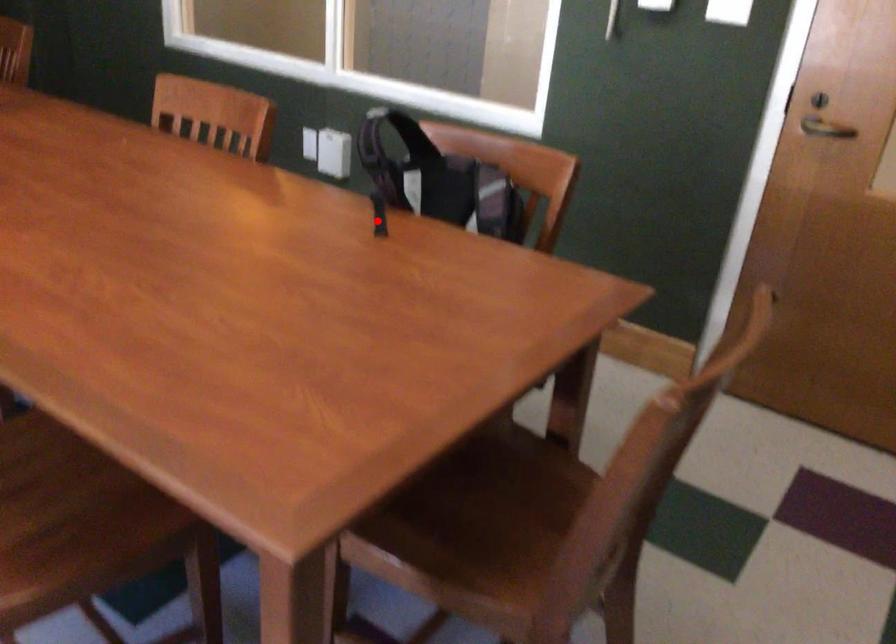
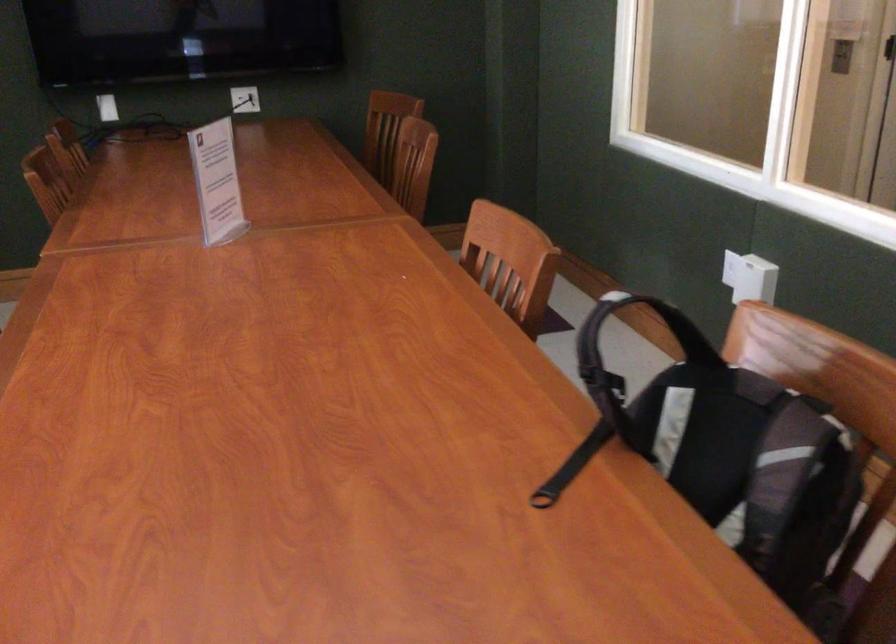
Question: I am providing you with two images of the same scene from different viewpoints. Image1 has a red point marked. In image2, the corresponding 3D location appears at what relative position? Reply with the corresponding letter.

Choices:
 (A) Closer
 (B) Farther

Answer: (A)